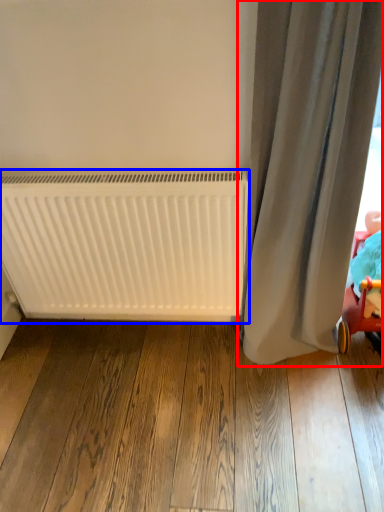
Question: Which point is closer to the camera, curtain (highlighted by a red box) or radiator (highlighted by a blue box)?

Choices:
 (A) curtain
 (B) radiator

Answer: (A)